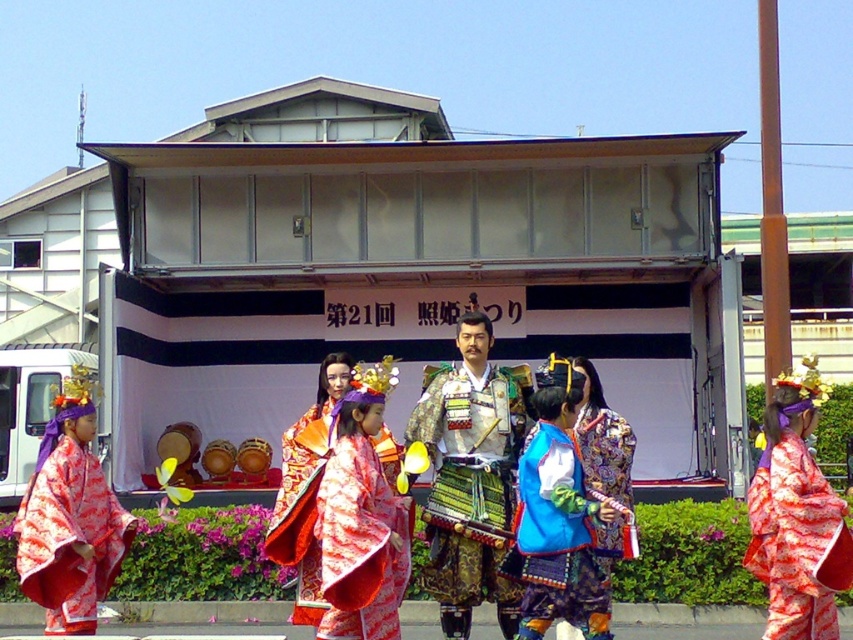
Does point (753, 524) come behind point (71, 621)?

Yes, it is behind point (71, 621).

Does matte red kimono at center have a greater width compared to matte pink kimono at left?

In fact, matte red kimono at center might be narrower than matte pink kimono at left.

Does point (798, 625) come behind point (61, 609)?

No, (798, 625) is in front of (61, 609).

Find the location of a particular element. The image size is (853, 640). matte red kimono at center is located at coordinates (798, 516).

Does green textured armor at center have a lesser height compared to matte pink kimono at left?

No, green textured armor at center is not shorter than matte pink kimono at left.

Can you confirm if green textured armor at center is taller than matte pink kimono at left?

Correct, green textured armor at center is much taller as matte pink kimono at left.

Find the location of `green textured armor at center`. green textured armor at center is located at coordinates (471, 476).

Identify the location of green textured armor at center. (471, 476).

Measure the distance between point (759, 563) and camera.

8.52 meters

Is point (807, 461) less distant than point (363, 584)?

No, it is not.

What do you see at coordinates (798, 516) in the screenshot? The height and width of the screenshot is (640, 853). I see `matte red kimono at center` at bounding box center [798, 516].

The height and width of the screenshot is (640, 853). What are the coordinates of `matte red kimono at center` in the screenshot? It's located at (798, 516).